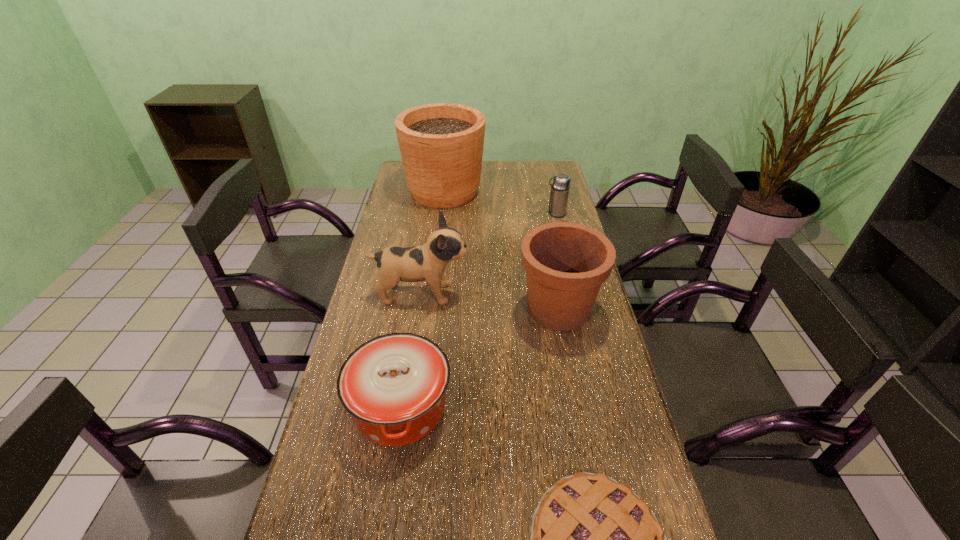
In order to click on object that is positioned at the far left corner in this screenshot , I will do `click(441, 144)`.

In the image, there is a desktop. At what (x,y) coordinates should I click in order to perform the action: click on blank space at the far edge. Please return your answer as a coordinate pair (x, y). Looking at the image, I should click on (514, 177).

Where is `vacant space at the left edge of the desktop`? Image resolution: width=960 pixels, height=540 pixels. vacant space at the left edge of the desktop is located at coordinates (407, 200).

The image size is (960, 540). What are the coordinates of `vacant space at the right edge of the desktop` in the screenshot? It's located at (624, 381).

The height and width of the screenshot is (540, 960). What are the coordinates of `vacant area at the far left corner` in the screenshot? It's located at (397, 180).

Find the location of a particular element. This screenshot has width=960, height=540. vacant space that's between the farther flowerpot and the nearer flowerpot is located at coordinates (501, 250).

The image size is (960, 540). I want to click on free space between the fifth farthest object and the right flowerpot, so click(x=480, y=357).

This screenshot has height=540, width=960. I want to click on vacant space that's between the fifth farthest object and the thermos bottle, so click(478, 310).

Locate an element on the screen. The width and height of the screenshot is (960, 540). free spot between the farther flowerpot and the right flowerpot is located at coordinates (501, 250).

Locate an element on the screen. object that is the fourth nearest to the shortest object is located at coordinates (561, 184).